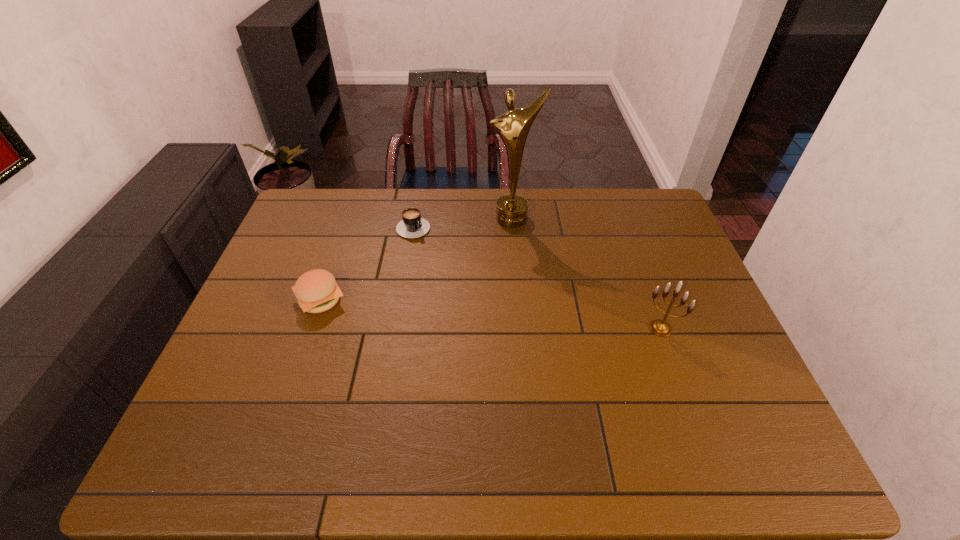
The height and width of the screenshot is (540, 960). In order to click on vacant spot on the desktop that is between the hamburger and the candelabrum and is positioned with the handle on the side of the shortest object in this screenshot , I will do `click(518, 316)`.

Find the location of a particular element. The height and width of the screenshot is (540, 960). free space on the desktop that is between the leftmost object and the second tallest object and is positioned on the front-facing side of the tallest object is located at coordinates (516, 316).